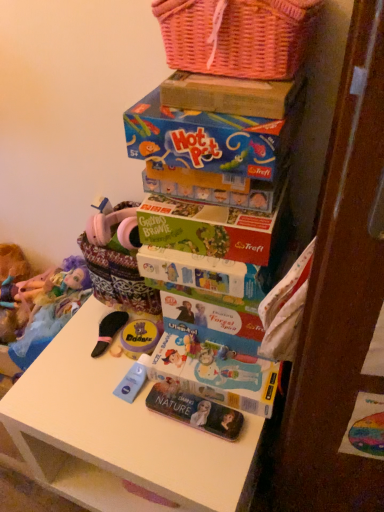
You are a GUI agent. You are given a task and a screenshot of the screen. Output one action in this format:
    pyautogui.click(x=<x>, y=<y>)
    Task: Click on the vacant space to the left of matt paper comic book at center
    The image size is (384, 512).
    Given the screenshot: What is the action you would take?
    pyautogui.click(x=89, y=388)